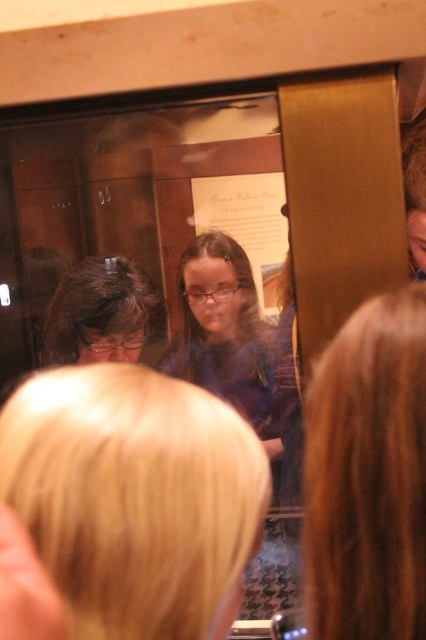
Question: Estimate the real-world distances between objects in this image. Which object is closer to the blonde hair at upper center?

Choices:
 (A) purple fabric at center
 (B) dark brown hair at left

Answer: (A)

Question: Based on their relative distances, which object is farther from the blonde hair at upper center?

Choices:
 (A) purple fabric at center
 (B) dark brown hair at left

Answer: (B)

Question: Among these points, which one is nearest to the camera?

Choices:
 (A) (244, 301)
 (B) (397, 442)
 (C) (55, 300)

Answer: (B)

Question: Can you confirm if blonde hair at upper center is wider than purple fabric at center?

Choices:
 (A) yes
 (B) no

Answer: (B)

Question: Is purple fabric at center further to camera compared to dark brown hair at left?

Choices:
 (A) no
 (B) yes

Answer: (A)

Question: Does purple fabric at center lie in front of dark brown hair at left?

Choices:
 (A) yes
 (B) no

Answer: (A)